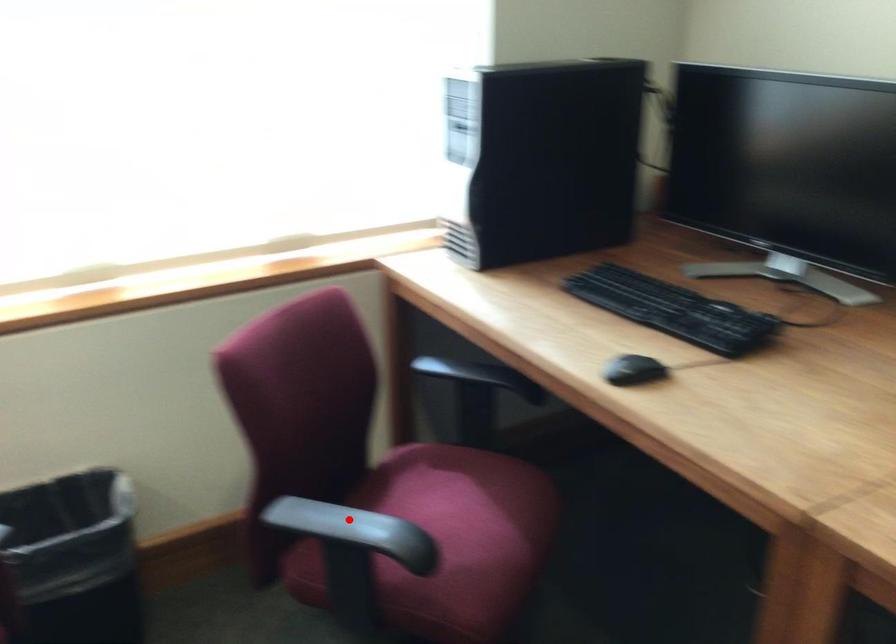
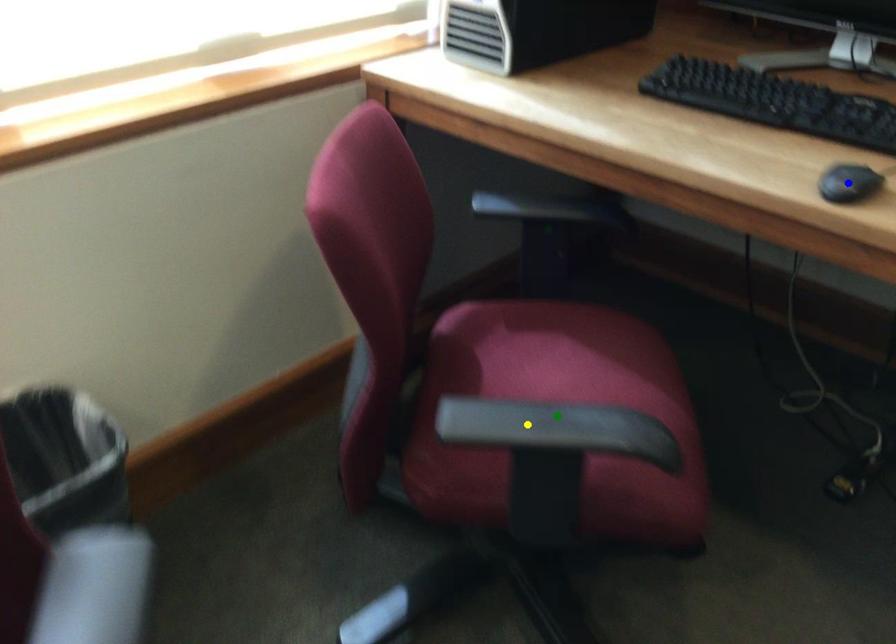
Question: I am providing you with two images of the same scene from different viewpoints. A red point is marked on the first image. You are given multiple points on the second image. Which spot in image 2 lines up with the point in image 1?

Choices:
 (A) green point
 (B) blue point
 (C) yellow point

Answer: (A)